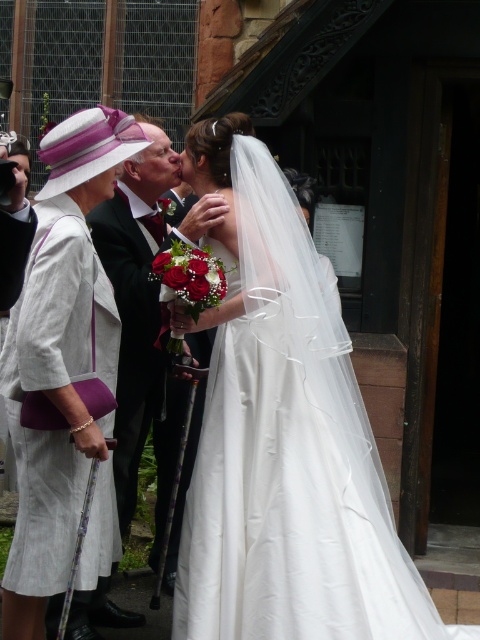
Question: Which of the following is the closest to the observer?

Choices:
 (A) black satin suit at center
 (B) white satin dress at center

Answer: (B)

Question: Can you confirm if white linen dress at left is positioned to the left of black satin suit at center?

Choices:
 (A) no
 (B) yes

Answer: (B)

Question: Estimate the real-world distances between objects in this image. Which object is farther from the black satin suit at center?

Choices:
 (A) white satin dress at center
 (B) white linen dress at left

Answer: (A)

Question: Is the position of white satin dress at center less distant than that of white linen dress at left?

Choices:
 (A) no
 (B) yes

Answer: (A)

Question: In this image, where is white linen dress at left located relative to black satin suit at center?

Choices:
 (A) left
 (B) right

Answer: (A)

Question: Which point appears farthest from the camera in this image?

Choices:
 (A) (291, 285)
 (B) (143, 333)

Answer: (B)